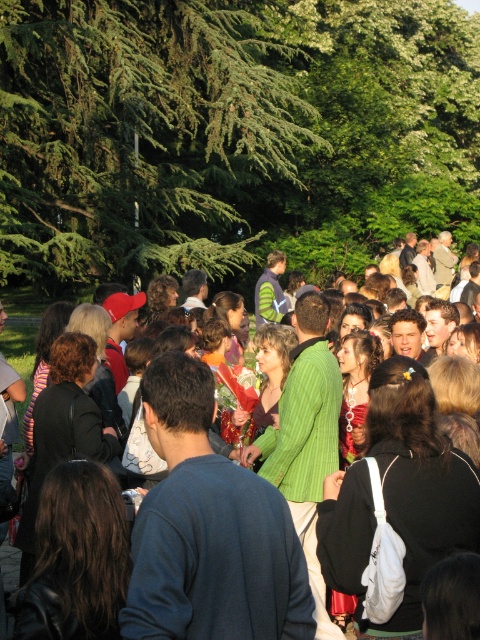
Question: Which point is farther to the camera?

Choices:
 (A) green leafy tree at upper left
 (B) green textured sweater at center

Answer: (A)

Question: Is green leafy tree at upper left bigger than green textured sweater at center?

Choices:
 (A) yes
 (B) no

Answer: (A)

Question: Does green leafy tree at upper left come behind green textured sweater at center?

Choices:
 (A) yes
 (B) no

Answer: (A)

Question: Which point is farther to the camera?

Choices:
 (A) (437, 499)
 (B) (84, 268)

Answer: (B)

Question: Can you confirm if green leafy tree at upper left is positioned to the right of green textured sweater at center?

Choices:
 (A) yes
 (B) no

Answer: (B)

Question: Which of the following is the farthest from the observer?

Choices:
 (A) (466, 531)
 (B) (137, 144)

Answer: (B)